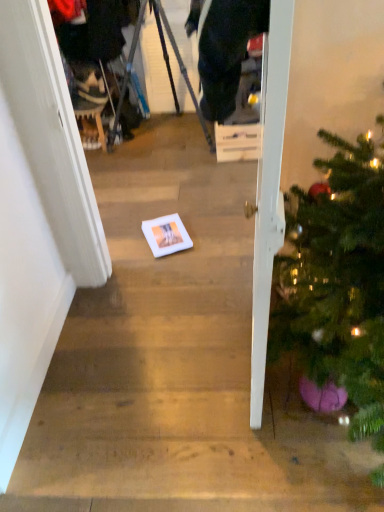
Identify the location of vacant position to the left of white glossy door at right. (162, 354).